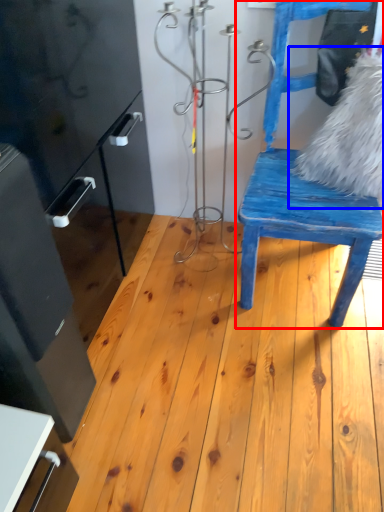
Question: Which object is closer to the camera taking this photo, chair (highlighted by a red box) or animal (highlighted by a blue box)?

Choices:
 (A) chair
 (B) animal

Answer: (A)